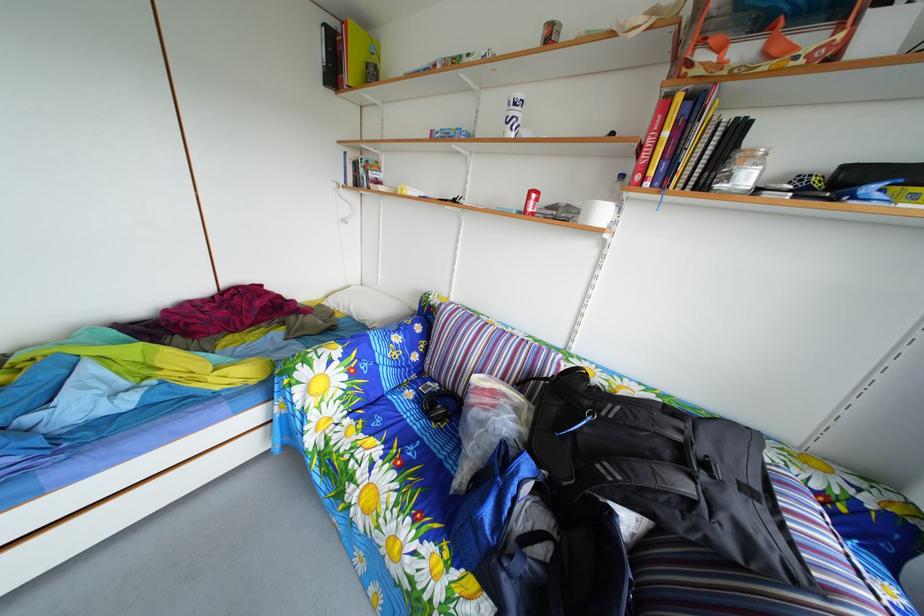
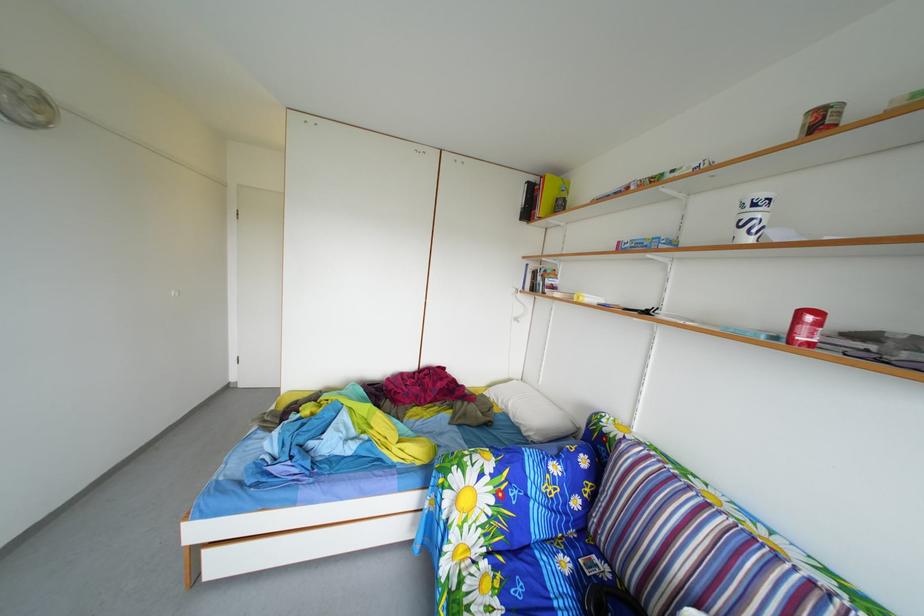
The point at (420, 402) is marked in the first image. Where is the corresponding point in the second image?

(576, 570)